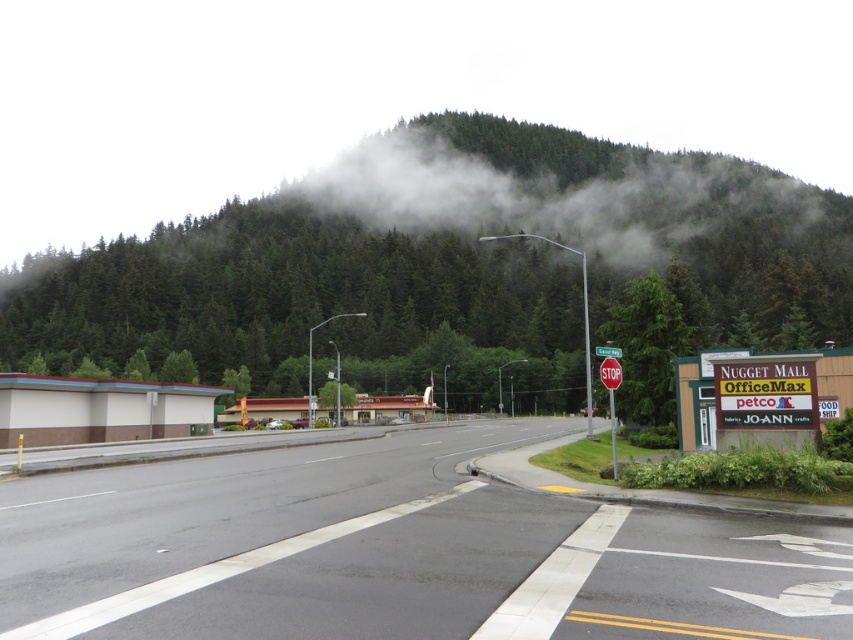
You are a delivery driver who needs to park your vehicle in the parking lot next to Nugget Mall. There is a green matte tree at center in your way. Based on the coordinates provided, can you estimate whether the tree is positioned to the left or right side of the parking lot?

The green matte tree at center is located at coordinates point [647,348]. Since the parking lot is on the right side of the image, the tree is positioned to the left side of the parking lot.

You are driving a car and approaching the intersection. You see the asphalt road at center and the red metallic stop sign at upper center. Which object is closer to you as you drive towards the intersection?

The asphalt road at center is closer to you because it is in front of the red metallic stop sign at upper center, indicating that the road is nearer in your line of sight.